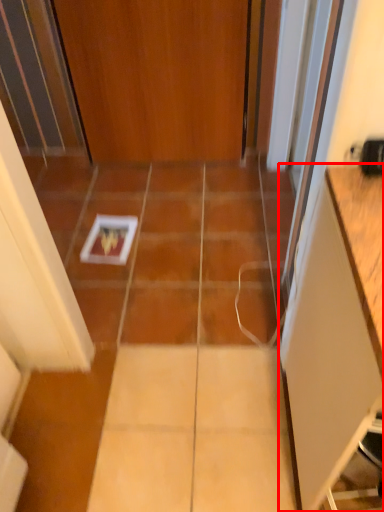
Question: From the image's perspective, where is cabinetry (annotated by the red box) located relative to door?

Choices:
 (A) below
 (B) above

Answer: (A)